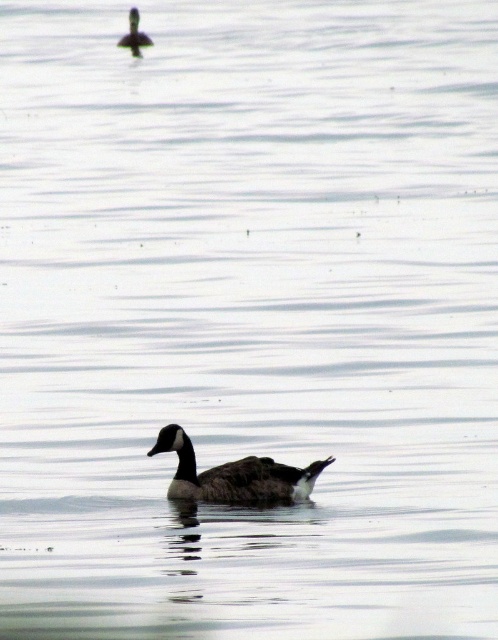
This screenshot has height=640, width=498. What do you see at coordinates (235, 476) in the screenshot?
I see `dark brown feathered duck at center` at bounding box center [235, 476].

Locate an element on the screen. dark brown feathered duck at center is located at coordinates (235, 476).

What do you see at coordinates (235, 476) in the screenshot? I see `dark brown feathered duck at center` at bounding box center [235, 476].

At what (x,y) coordinates should I click in order to perform the action: click on dark brown feathered duck at center. Please return your answer as a coordinate pair (x, y). This screenshot has width=498, height=640. Looking at the image, I should click on coord(235,476).